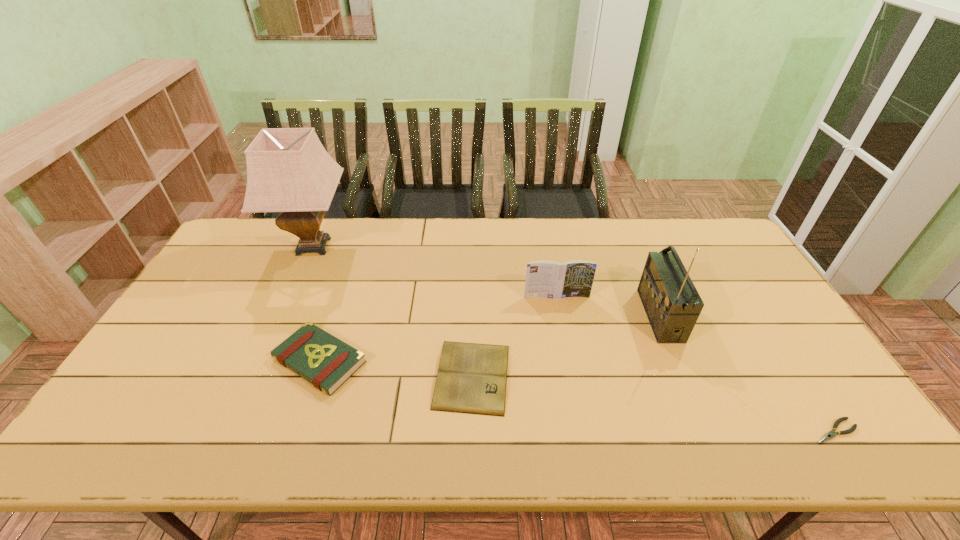
You are a GUI agent. You are given a task and a screenshot of the screen. Output one action in this format:
    pyautogui.click(x=<x>, y=<y>)
    Task: Click on the pliers
    Image resolution: width=960 pixels, height=540 pixels.
    Given the screenshot: What is the action you would take?
    pyautogui.click(x=828, y=436)

Where is `the rightmost object`? This screenshot has width=960, height=540. the rightmost object is located at coordinates [828, 436].

Find the location of `vacant space located 0.160m on the front of the farthest object`. vacant space located 0.160m on the front of the farthest object is located at coordinates (287, 306).

At what (x,y) coordinates should I click in order to perform the action: click on vacant space located on the front panel of the second tallest object. Please return your answer as a coordinate pair (x, y). Looking at the image, I should click on (601, 315).

The height and width of the screenshot is (540, 960). I want to click on vacant space located 0.170m on the front panel of the second tallest object, so click(588, 315).

Where is `vacant space situated 0.170m on the front panel of the second tallest object`? The image size is (960, 540). vacant space situated 0.170m on the front panel of the second tallest object is located at coordinates (588, 315).

Identify the location of vacant space located 0.110m on the front cover of the rightmost book. Image resolution: width=960 pixels, height=540 pixels. (562, 326).

The width and height of the screenshot is (960, 540). Identify the location of vacant region located on the front of the leftmost book. (294, 439).

I want to click on vacant space located 0.400m on the left of the fourth object from right to left, so click(x=278, y=376).

Locate an element on the screen. The image size is (960, 540). free space located on the left of the nearest object is located at coordinates (776, 431).